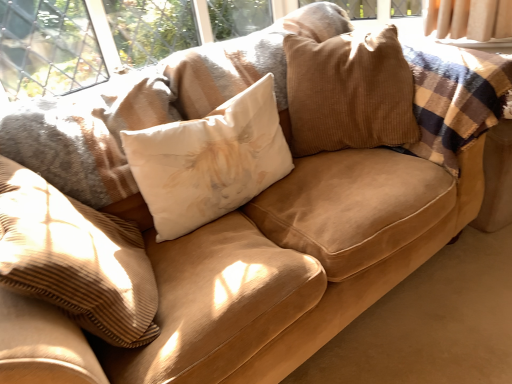
Question: Which direction should I rotate to look at corduroy pillow at center, which ranks as the first pillow in right-to-left order?

Choices:
 (A) left
 (B) right

Answer: (B)

Question: Can you confirm if white corduroy pillow at center, acting as the third pillow starting from the right, is thinner than white cotton pillow at center, which is counted as the second pillow, starting from the left?

Choices:
 (A) yes
 (B) no

Answer: (B)

Question: Is the depth of white corduroy pillow at center, acting as the third pillow starting from the right, less than that of white cotton pillow at center, positioned as the second pillow in right-to-left order?

Choices:
 (A) yes
 (B) no

Answer: (A)

Question: Is white corduroy pillow at center, acting as the third pillow starting from the right, facing towards white cotton pillow at center, positioned as the second pillow in right-to-left order?

Choices:
 (A) no
 (B) yes

Answer: (B)

Question: From the image's perspective, is white corduroy pillow at center, acting as the third pillow starting from the right, located beneath white cotton pillow at center, positioned as the second pillow in right-to-left order?

Choices:
 (A) yes
 (B) no

Answer: (A)

Question: Is white corduroy pillow at center, acting as the third pillow starting from the right, not within white cotton pillow at center, which is counted as the second pillow, starting from the left?

Choices:
 (A) no
 (B) yes

Answer: (B)

Question: Considering the relative sizes of white corduroy pillow at center, acting as the third pillow starting from the right, and white cotton pillow at center, which is counted as the second pillow, starting from the left, in the image provided, is white corduroy pillow at center, acting as the third pillow starting from the right, taller than white cotton pillow at center, which is counted as the second pillow, starting from the left,?

Choices:
 (A) no
 (B) yes

Answer: (B)

Question: Would you consider corduroy pillow at center, which ranks as the first pillow in right-to-left order, to be distant from white corduroy pillow at center, acting as the third pillow starting from the right?

Choices:
 (A) yes
 (B) no

Answer: (B)

Question: Can we say corduroy pillow at center, which is the 3th pillow in left-to-right order, lies outside white corduroy pillow at center, the 1th pillow in the left-to-right sequence?

Choices:
 (A) yes
 (B) no

Answer: (A)

Question: Is corduroy pillow at center, which ranks as the first pillow in right-to-left order, at the right side of white corduroy pillow at center, acting as the third pillow starting from the right?

Choices:
 (A) yes
 (B) no

Answer: (A)

Question: Is corduroy pillow at center, which is the 3th pillow in left-to-right order, at the left side of white corduroy pillow at center, the 1th pillow in the left-to-right sequence?

Choices:
 (A) no
 (B) yes

Answer: (A)

Question: From the image's perspective, would you say corduroy pillow at center, which is the 3th pillow in left-to-right order, is shown under white corduroy pillow at center, acting as the third pillow starting from the right?

Choices:
 (A) no
 (B) yes

Answer: (A)

Question: Does corduroy pillow at center, which ranks as the first pillow in right-to-left order, have a greater width compared to white corduroy pillow at center, the 1th pillow in the left-to-right sequence?

Choices:
 (A) no
 (B) yes

Answer: (B)

Question: Is white cotton pillow at center, which is counted as the second pillow, starting from the left, at the left side of white corduroy pillow at center, acting as the third pillow starting from the right?

Choices:
 (A) no
 (B) yes

Answer: (A)